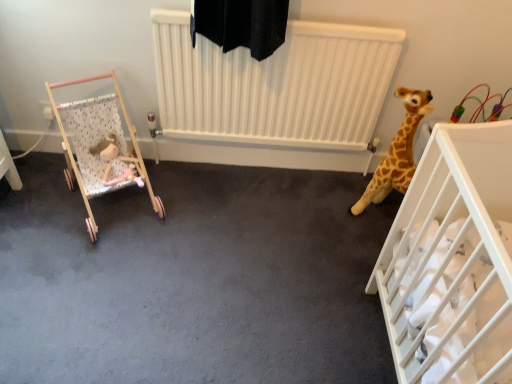
Question: Is wooden stroller at left, positioned as the first infant bed in left-to-right order, with white plastic crib at right, which is the first infant bed in right-to-left order?

Choices:
 (A) yes
 (B) no

Answer: (B)

Question: From a real-world perspective, is wooden stroller at left, positioned as the first infant bed in left-to-right order, located higher than white plastic crib at right, which is counted as the 2th infant bed, starting from the left?

Choices:
 (A) yes
 (B) no

Answer: (B)

Question: Is wooden stroller at left, positioned as the first infant bed in left-to-right order, positioned beyond the bounds of white plastic crib at right, which is the first infant bed in right-to-left order?

Choices:
 (A) yes
 (B) no

Answer: (A)

Question: Is wooden stroller at left, arranged as the 2th infant bed when viewed from the right, positioned far away from white plastic crib at right, which is counted as the 2th infant bed, starting from the left?

Choices:
 (A) no
 (B) yes

Answer: (B)

Question: Considering the relative positions of wooden stroller at left, arranged as the 2th infant bed when viewed from the right, and white plastic crib at right, which is counted as the 2th infant bed, starting from the left, in the image provided, is wooden stroller at left, arranged as the 2th infant bed when viewed from the right, to the left of white plastic crib at right, which is counted as the 2th infant bed, starting from the left, from the viewer's perspective?

Choices:
 (A) yes
 (B) no

Answer: (A)

Question: From the image's perspective, is fluffy pink plush at left above or below white plastic crib at right, which is the first infant bed in right-to-left order?

Choices:
 (A) above
 (B) below

Answer: (A)

Question: Looking at their shapes, would you say fluffy pink plush at left is wider or thinner than white plastic crib at right, which is the first infant bed in right-to-left order?

Choices:
 (A) wide
 (B) thin

Answer: (B)

Question: Is fluffy pink plush at left situated inside white plastic crib at right, which is the first infant bed in right-to-left order, or outside?

Choices:
 (A) outside
 (B) inside

Answer: (A)

Question: Is point (118, 168) closer or farther from the camera than point (489, 185)?

Choices:
 (A) closer
 (B) farther

Answer: (B)

Question: Is wooden stroller at left, positioned as the first infant bed in left-to-right order, taller or shorter than fluffy pink plush at left?

Choices:
 (A) short
 (B) tall

Answer: (B)

Question: From a real-world perspective, relative to fluffy pink plush at left, is wooden stroller at left, positioned as the first infant bed in left-to-right order, vertically above or below?

Choices:
 (A) below
 (B) above

Answer: (B)

Question: Looking at their shapes, would you say wooden stroller at left, positioned as the first infant bed in left-to-right order, is wider or thinner than fluffy pink plush at left?

Choices:
 (A) wide
 (B) thin

Answer: (A)

Question: In the image, is wooden stroller at left, positioned as the first infant bed in left-to-right order, positioned in front of or behind fluffy pink plush at left?

Choices:
 (A) behind
 (B) front

Answer: (B)

Question: From the image's perspective, is white plastic crib at right, which is the first infant bed in right-to-left order, positioned above or below fluffy pink plush at left?

Choices:
 (A) above
 (B) below

Answer: (B)

Question: Considering the positions of point (507, 281) and point (137, 183), is point (507, 281) closer or farther from the camera than point (137, 183)?

Choices:
 (A) farther
 (B) closer

Answer: (B)